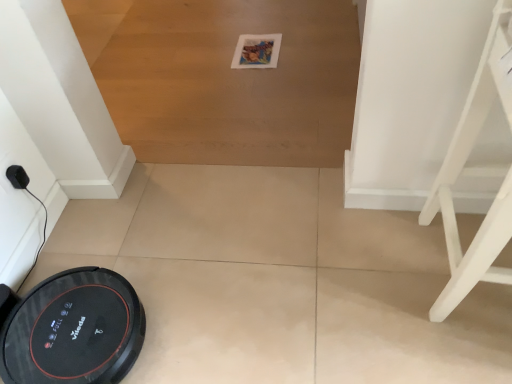
The width and height of the screenshot is (512, 384). In order to click on free region under white wood chair at right (from a real-world perspective) in this screenshot , I will do `click(467, 296)`.